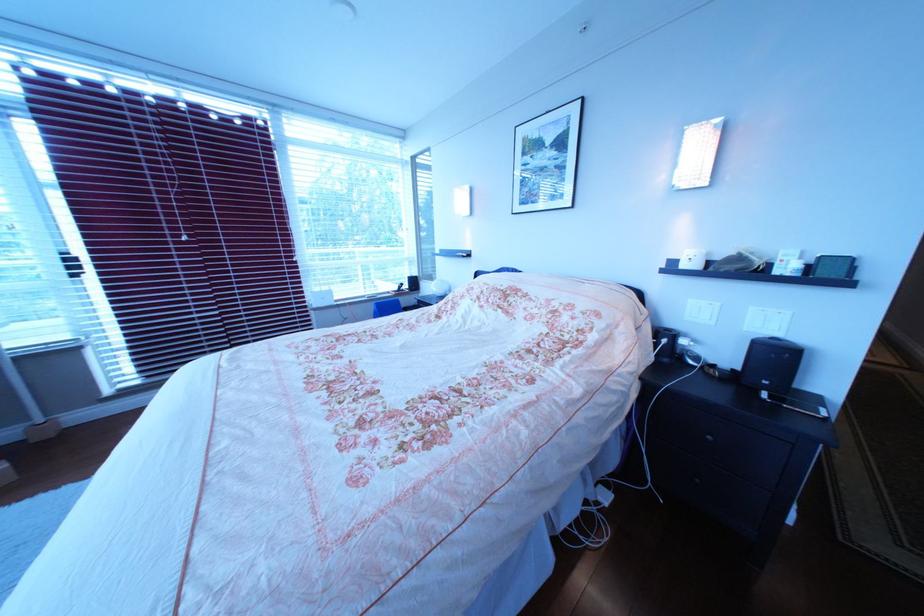
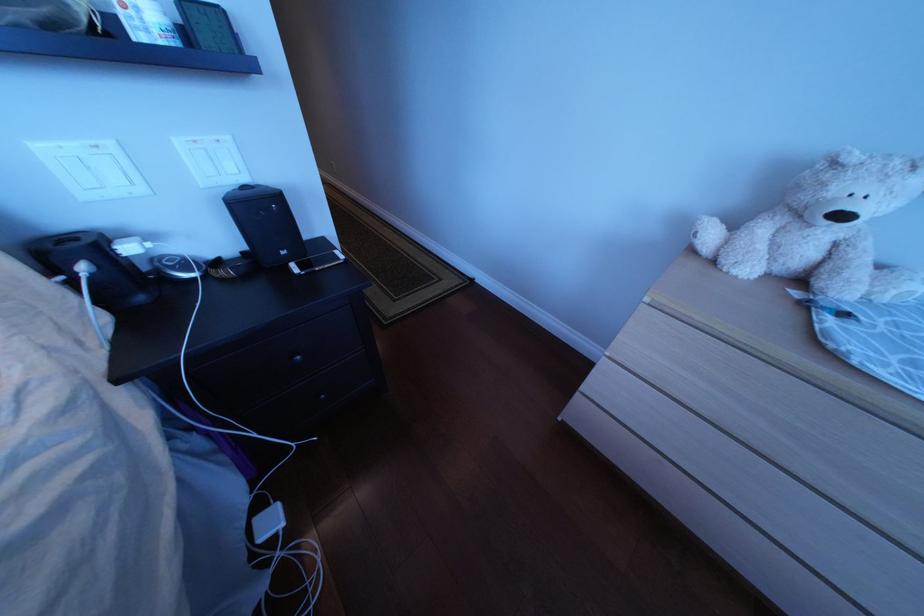
The images are taken continuously from a first-person perspective. In which direction is your viewpoint rotating?

The camera's rotation is toward right-down.